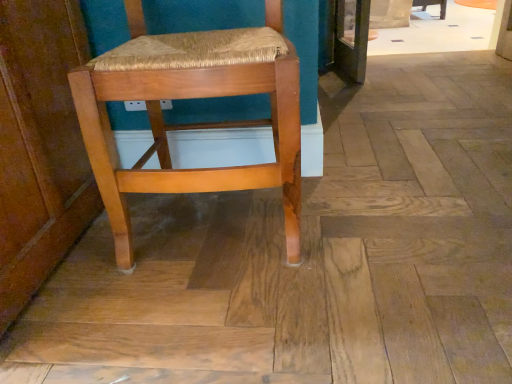
Question: Does wooden chair at center, which appears as the first chair when viewed from the right, have a smaller size compared to wooden woven seat at center, positioned as the second chair in right-to-left order?

Choices:
 (A) no
 (B) yes

Answer: (B)

Question: Is wooden chair at center, positioned as the second chair in bottom-to-top order, facing towards wooden woven seat at center, arranged as the 1th chair when ordered from the bottom?

Choices:
 (A) no
 (B) yes

Answer: (B)

Question: Considering the relative sizes of wooden chair at center, the 2th chair positioned from the front, and wooden woven seat at center, the second chair from the back, in the image provided, is wooden chair at center, the 2th chair positioned from the front, wider than wooden woven seat at center, the second chair from the back,?

Choices:
 (A) no
 (B) yes

Answer: (B)

Question: Can you confirm if wooden chair at center, which appears as the second chair when viewed from the left, is shorter than wooden woven seat at center, which is the second chair from top to bottom?

Choices:
 (A) no
 (B) yes

Answer: (B)

Question: Is wooden chair at center, which appears as the second chair when viewed from the left, bigger than wooden woven seat at center, the first chair viewed from the left?

Choices:
 (A) no
 (B) yes

Answer: (A)

Question: From a real-world perspective, is wooden chair at center, which appears as the second chair when viewed from the left, on top of wooden woven seat at center, arranged as the 1th chair when ordered from the bottom?

Choices:
 (A) yes
 (B) no

Answer: (B)

Question: Can we say wooden woven seat at center, arranged as the 1th chair when ordered from the bottom, lies outside wooden chair at center, which is counted as the 1th chair, starting from the back?

Choices:
 (A) no
 (B) yes

Answer: (B)

Question: Is wooden woven seat at center, the first chair viewed from the left, positioned behind wooden chair at center, which appears as the second chair when viewed from the left?

Choices:
 (A) no
 (B) yes

Answer: (A)

Question: Considering the relative sizes of wooden woven seat at center, the second chair from the back, and wooden chair at center, positioned as the second chair in bottom-to-top order, in the image provided, is wooden woven seat at center, the second chair from the back, thinner than wooden chair at center, positioned as the second chair in bottom-to-top order,?

Choices:
 (A) no
 (B) yes

Answer: (B)

Question: Considering the relative sizes of wooden woven seat at center, the second chair from the back, and wooden chair at center, positioned as the second chair in bottom-to-top order, in the image provided, is wooden woven seat at center, the second chair from the back, taller than wooden chair at center, positioned as the second chair in bottom-to-top order,?

Choices:
 (A) yes
 (B) no

Answer: (A)

Question: Is wooden woven seat at center, the second chair from the back, in front of wooden chair at center, which appears as the first chair when viewed from the right?

Choices:
 (A) yes
 (B) no

Answer: (A)

Question: Considering the relative sizes of wooden woven seat at center, positioned as the second chair in right-to-left order, and wooden chair at center, the 2th chair positioned from the front, in the image provided, is wooden woven seat at center, positioned as the second chair in right-to-left order, shorter than wooden chair at center, the 2th chair positioned from the front,?

Choices:
 (A) no
 (B) yes

Answer: (A)

Question: Is wooden woven seat at center, arranged as the 1th chair when ordered from the bottom, bigger or smaller than wooden chair at center, which is counted as the 1th chair, starting from the back?

Choices:
 (A) small
 (B) big

Answer: (B)